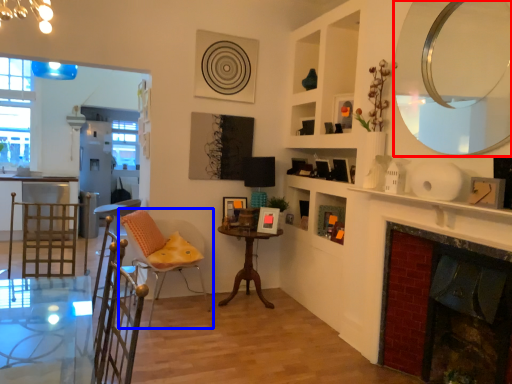
Question: Which of the following is the farthest to the observer, mirror (highlighted by a red box) or chair (highlighted by a blue box)?

Choices:
 (A) mirror
 (B) chair

Answer: (B)